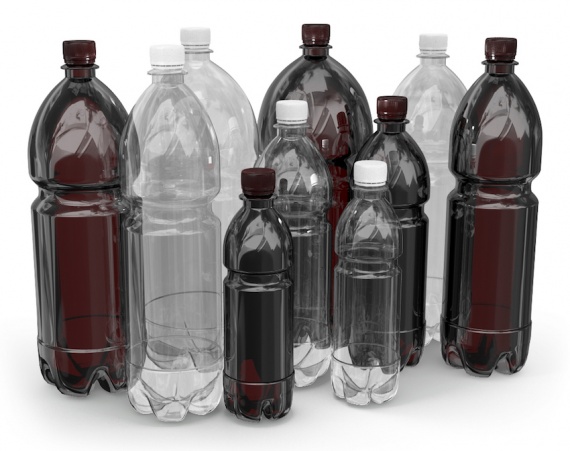
Locate an element on the screen. The height and width of the screenshot is (451, 570). clear bottles is located at coordinates 169,130, 206,98, 293,169, 368,237, 430,89.